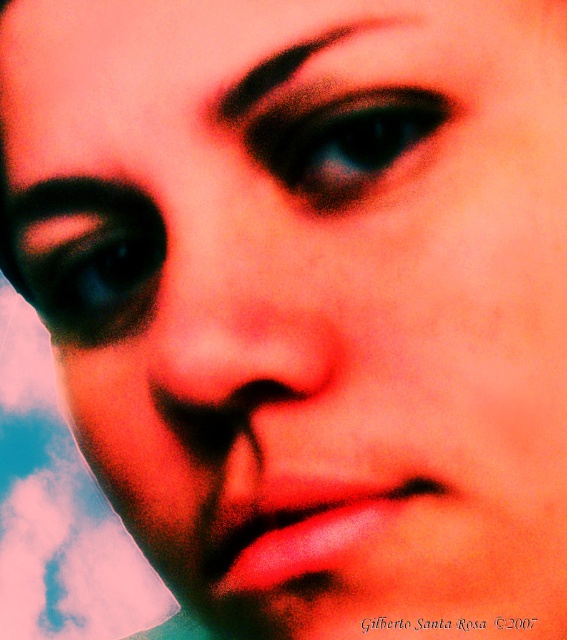
Question: Which object appears farthest from the camera in this image?

Choices:
 (A) black matte eyebrow at upper center
 (B) matte red nose at center

Answer: (A)

Question: Can you confirm if matte red nose at center is wider than black glittery eye at center?

Choices:
 (A) yes
 (B) no

Answer: (A)

Question: Among these objects, which one is farthest from the camera?

Choices:
 (A) black glittery eye at center
 (B) matte red nose at center
 (C) black matte eyebrow at upper center

Answer: (A)

Question: Is black glittery eye at center to the left of matte black eye at upper left from the viewer's perspective?

Choices:
 (A) no
 (B) yes

Answer: (A)

Question: In this image, where is matte black eye at upper left located relative to black matte eyebrow at upper center?

Choices:
 (A) above
 (B) below

Answer: (B)

Question: Which point appears closest to the camera in this image?

Choices:
 (A) (301, 104)
 (B) (261, 376)
 (C) (70, 241)

Answer: (B)